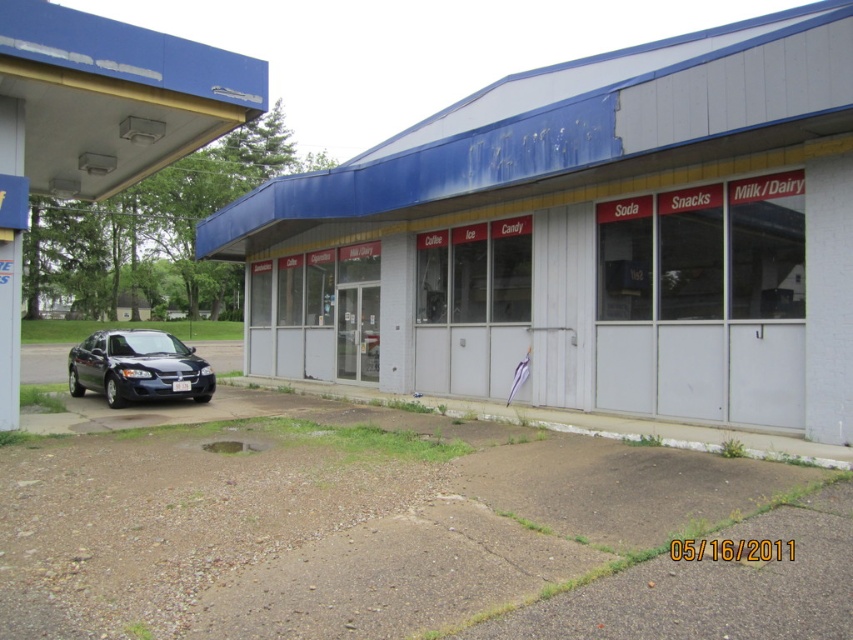
Question: Does white textured building at center have a lesser width compared to metallic blue gas station at left?

Choices:
 (A) no
 (B) yes

Answer: (A)

Question: Is metallic blue gas station at left thinner than shiny black sedan at lower left?

Choices:
 (A) no
 (B) yes

Answer: (B)

Question: Among these objects, which one is farthest from the camera?

Choices:
 (A) metallic blue gas station at left
 (B) shiny black sedan at lower left

Answer: (B)

Question: Which object is closer to the camera taking this photo?

Choices:
 (A) metallic blue gas station at left
 (B) shiny black sedan at lower left

Answer: (A)

Question: Which object appears farthest from the camera in this image?

Choices:
 (A) metallic blue gas station at left
 (B) shiny black sedan at lower left
 (C) white textured building at center

Answer: (B)

Question: Can you confirm if metallic blue gas station at left is positioned below shiny black sedan at lower left?

Choices:
 (A) no
 (B) yes

Answer: (A)